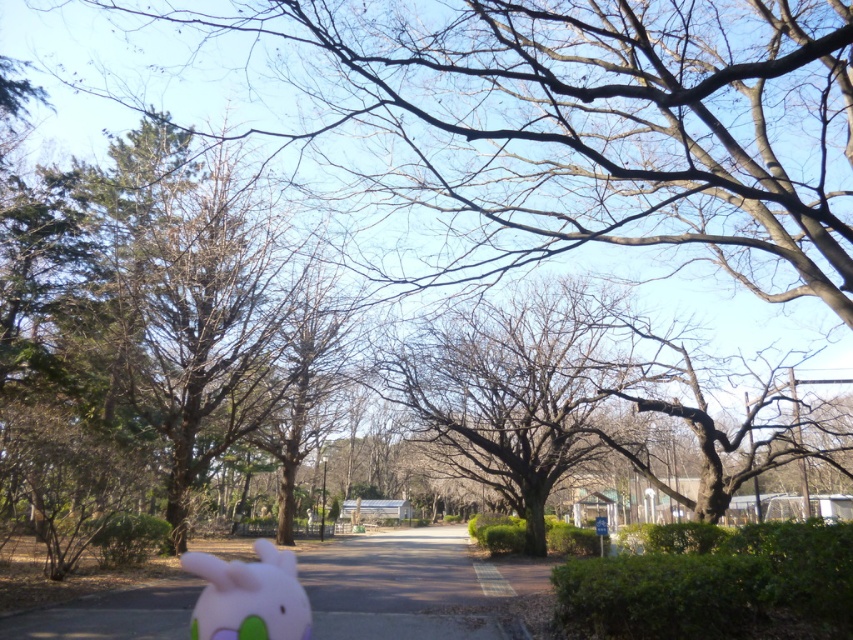
Who is higher up, bare branches at center or pink felt plushie at lower left?

bare branches at center

What do you see at coordinates (508, 388) in the screenshot? Image resolution: width=853 pixels, height=640 pixels. I see `bare branches at center` at bounding box center [508, 388].

Image resolution: width=853 pixels, height=640 pixels. What are the coordinates of `bare branches at center` in the screenshot? It's located at (508, 388).